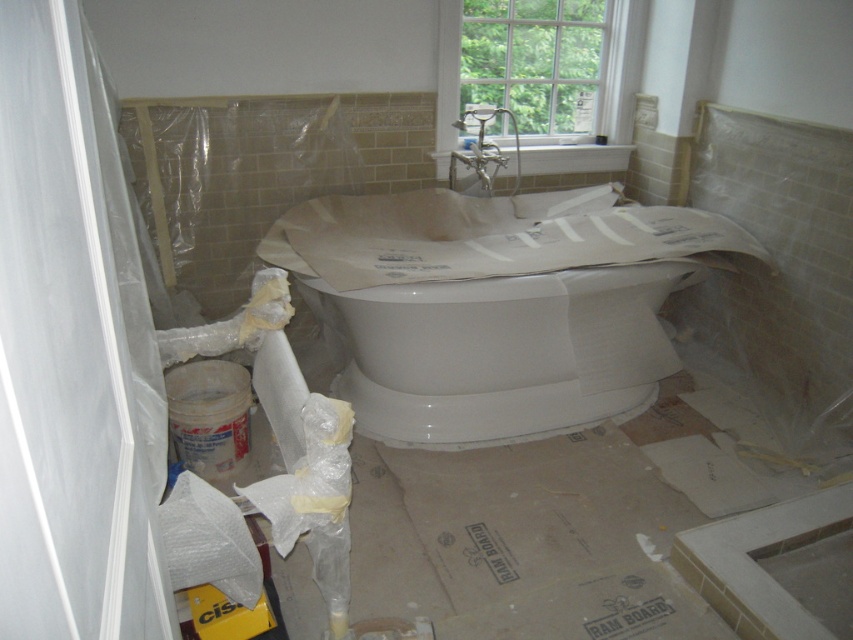
You are a contractor who needs to install a new showerhead that requires 2 meters of clearance from the camera. Can the showerhead be installed on the white glossy bathtub at center without violating the clearance requirement?

The distance between the white glossy bathtub at center and the camera is 2.25 meters, which exceeds the required 2 meters of clearance. Therefore, the showerhead can be installed on the white glossy bathtub at center without violating the clearance requirement.

You are standing in the bathroom and want to reach a tool located at point [555,8]. There is an obstacle at point [589,307]. Will you encounter the obstacle before reaching the tool?

Yes, you will encounter the obstacle at point [589,307] before reaching the tool at point [555,8] because the obstacle is closer to you than the tool.

You are a contractor inspecting the bathroom renovation. You need to assess the distance between the white glossy bathtub at center and the clear glass window at upper center. Based on the scene, which object is nearer to you?

The white glossy bathtub at center is closer to the viewer than the clear glass window at upper center.